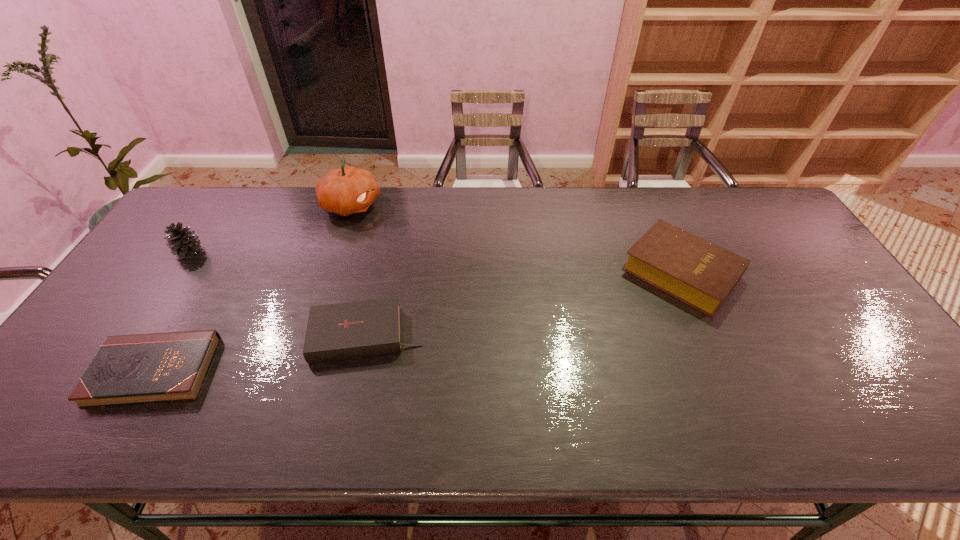
Locate an element on the screen. This screenshot has width=960, height=540. free region at the left edge of the desktop is located at coordinates (59, 384).

At what (x,y) coordinates should I click in order to perform the action: click on free space at the far left corner of the desktop. Please return your answer as a coordinate pair (x, y). The height and width of the screenshot is (540, 960). Looking at the image, I should click on 217,188.

Find the location of `vacant space at the far right corner of the desktop`. vacant space at the far right corner of the desktop is located at coordinates (730, 199).

Where is `free point between the shortest Bible and the second Bible from right to left`? The image size is (960, 540). free point between the shortest Bible and the second Bible from right to left is located at coordinates (260, 353).

Identify the location of free area in between the leftmost Bible and the farthest object. (253, 288).

Locate an element on the screen. This screenshot has height=540, width=960. free spot between the farthest object and the pinecone is located at coordinates (271, 228).

The width and height of the screenshot is (960, 540). In order to click on free space between the pumpkin and the third tallest object in this screenshot , I will do `click(516, 239)`.

I want to click on empty space between the second Bible from left to right and the leftmost Bible, so click(x=260, y=353).

You are a GUI agent. You are given a task and a screenshot of the screen. Output one action in this format:
    pyautogui.click(x=<x>, y=<y>)
    Task: Click on the blank region between the rightmost Bible and the second Bible from left to right
    
    Given the screenshot: What is the action you would take?
    pyautogui.click(x=524, y=303)

This screenshot has height=540, width=960. I want to click on free space between the rightmost Bible and the farthest object, so click(516, 239).